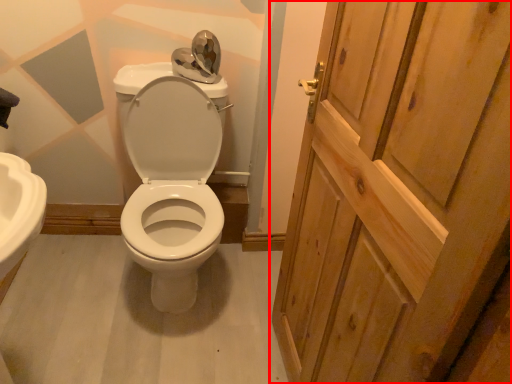
Question: From the image's perspective, what is the correct spatial positioning of door (annotated by the red box) in reference to porcelain?

Choices:
 (A) above
 (B) below

Answer: (B)